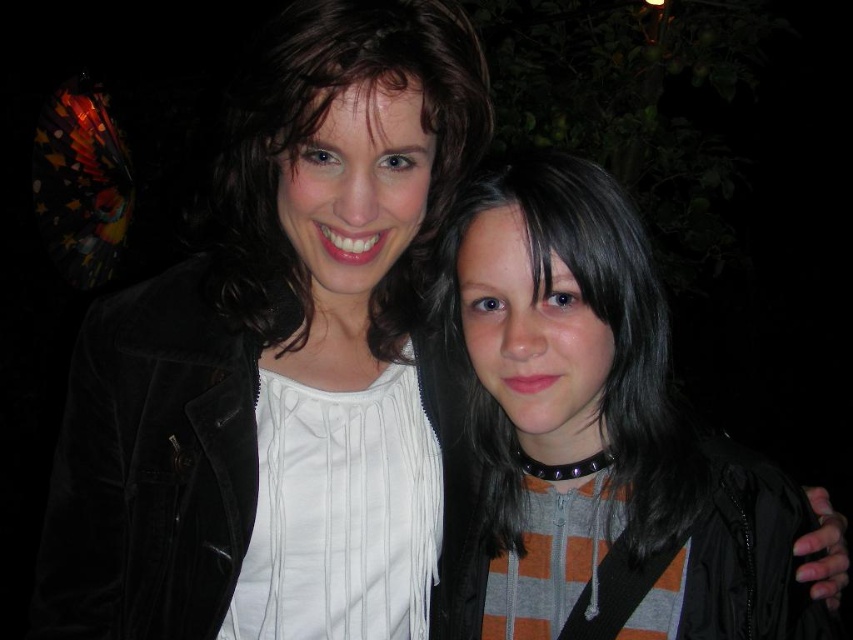
Consider the image. You are a photographer setting up for a night shoot and need to position two subjects so that their clothing details are visible. The subjects are wearing an orange striped hoodie at center and a matte black jacket at upper left. Based on their current positions, which clothing item is more to the right?

The orange striped hoodie at center is positioned on the right side of matte black jacket at upper left, so the orange striped hoodie at center is more to the right.

You are a photographer trying to capture a closeup of the two people in the image. You want to ensure that both points, point [577,577] and point [253,170], are in focus. Which point should you focus on to achieve this?

You should focus on point [577,577] because it is closer to the viewer than point [253,170]. By focusing on the closer point, both points will be within the depth of field and in focus.

You are a fashion designer analyzing the image. You need to determine which clothing item is wider between the orange striped hoodie at center and the matte black jacket at upper left. Which one is wider?

The orange striped hoodie at center is wider than the matte black jacket at upper left according to the description.